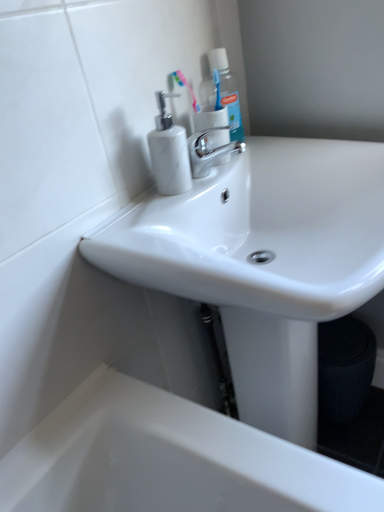
Question: Is translucent plastic mouthwash at upper center touching pink plastic toothbrush at upper center?

Choices:
 (A) yes
 (B) no

Answer: (A)

Question: Can you confirm if translucent plastic mouthwash at upper center is taller than pink plastic toothbrush at upper center?

Choices:
 (A) yes
 (B) no

Answer: (A)

Question: Is translucent plastic mouthwash at upper center completely or partially outside of pink plastic toothbrush at upper center?

Choices:
 (A) yes
 (B) no

Answer: (A)

Question: Is translucent plastic mouthwash at upper center at the left side of pink plastic toothbrush at upper center?

Choices:
 (A) no
 (B) yes

Answer: (A)

Question: Does translucent plastic mouthwash at upper center have a larger size compared to pink plastic toothbrush at upper center?

Choices:
 (A) no
 (B) yes

Answer: (B)

Question: Considering their positions, is white glossy toilet paper at upper center located in front of or behind white marble soap dispenser at upper left?

Choices:
 (A) behind
 (B) front

Answer: (A)

Question: Considering the relative positions of white glossy toilet paper at upper center and white marble soap dispenser at upper left in the image provided, is white glossy toilet paper at upper center to the left or to the right of white marble soap dispenser at upper left?

Choices:
 (A) right
 (B) left

Answer: (A)

Question: Is white glossy toilet paper at upper center taller or shorter than white marble soap dispenser at upper left?

Choices:
 (A) short
 (B) tall

Answer: (A)

Question: Considering the positions of point (213, 133) and point (157, 179), is point (213, 133) closer or farther from the camera than point (157, 179)?

Choices:
 (A) closer
 (B) farther

Answer: (B)

Question: Is point (218, 133) closer or farther from the camera than point (236, 108)?

Choices:
 (A) farther
 (B) closer

Answer: (B)

Question: Considering the positions of polished chrome faucet at center and translucent plastic mouthwash at upper center in the image, is polished chrome faucet at center taller or shorter than translucent plastic mouthwash at upper center?

Choices:
 (A) tall
 (B) short

Answer: (B)

Question: From a real-world perspective, is polished chrome faucet at center above or below translucent plastic mouthwash at upper center?

Choices:
 (A) below
 (B) above

Answer: (A)

Question: Looking at the image, does polished chrome faucet at center seem bigger or smaller compared to translucent plastic mouthwash at upper center?

Choices:
 (A) big
 (B) small

Answer: (B)

Question: Is pink plastic toothbrush at upper center in front of or behind translucent plastic mouthwash at upper center in the image?

Choices:
 (A) behind
 (B) front

Answer: (B)

Question: Considering the positions of pink plastic toothbrush at upper center and translucent plastic mouthwash at upper center in the image, is pink plastic toothbrush at upper center bigger or smaller than translucent plastic mouthwash at upper center?

Choices:
 (A) small
 (B) big

Answer: (A)